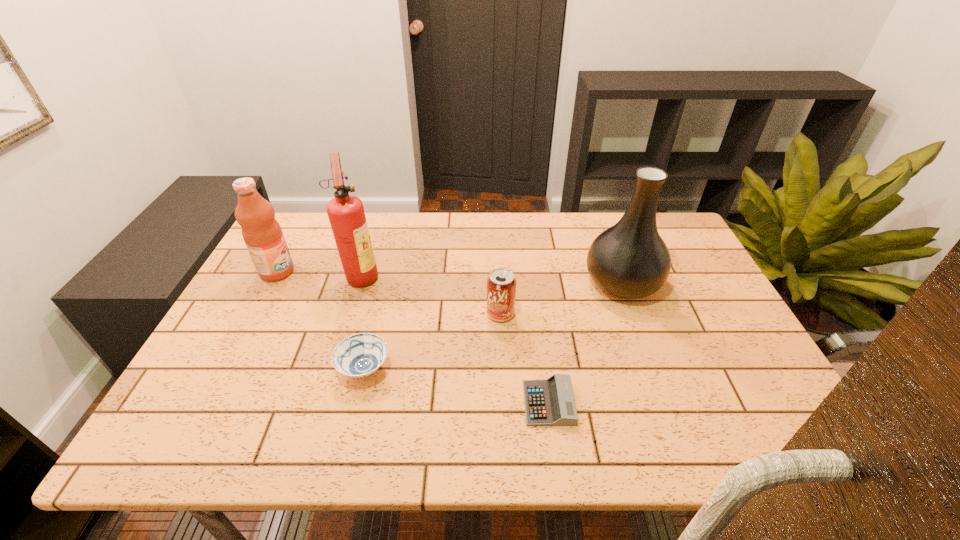
This screenshot has height=540, width=960. In order to click on free spot that satisfies the following two spatial constraints: 1. on the front label of the fourth shortest object; 2. on the back side of the calculator in this screenshot , I will do `click(206, 403)`.

This screenshot has height=540, width=960. Find the location of `vacant region that satisfies the following two spatial constraints: 1. on the front label of the fourth shortest object; 2. on the back side of the rightmost object`. vacant region that satisfies the following two spatial constraints: 1. on the front label of the fourth shortest object; 2. on the back side of the rightmost object is located at coordinates (272, 282).

This screenshot has width=960, height=540. I want to click on free space that satisfies the following two spatial constraints: 1. on the front label of the leftmost object; 2. on the right side of the fifth object from left to right, so click(x=206, y=403).

Identify the location of vacant region that satisfies the following two spatial constraints: 1. on the front-facing side of the third object from right to left; 2. on the left side of the fire extinguisher. The image size is (960, 540). (350, 314).